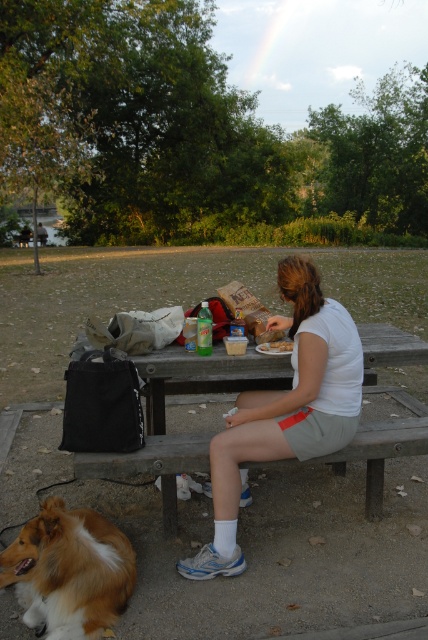
You are a photographer trying to capture the scene of a person sitting on the wooden picnic table at center. You notice the white cotton shirt at center is blocking part of the table. Can you estimate if the shirt is taller than the table?

The white cotton shirt at center is much taller as wooden picnic table at center, so yes, the shirt is blocking part of the table because it is taller than the table.

You are standing in the park and see the white cotton shirt at center and the wooden picnic table at center. Which object is positioned more to the right side?

The white cotton shirt at center is positioned more to the right side than the wooden picnic table at center.